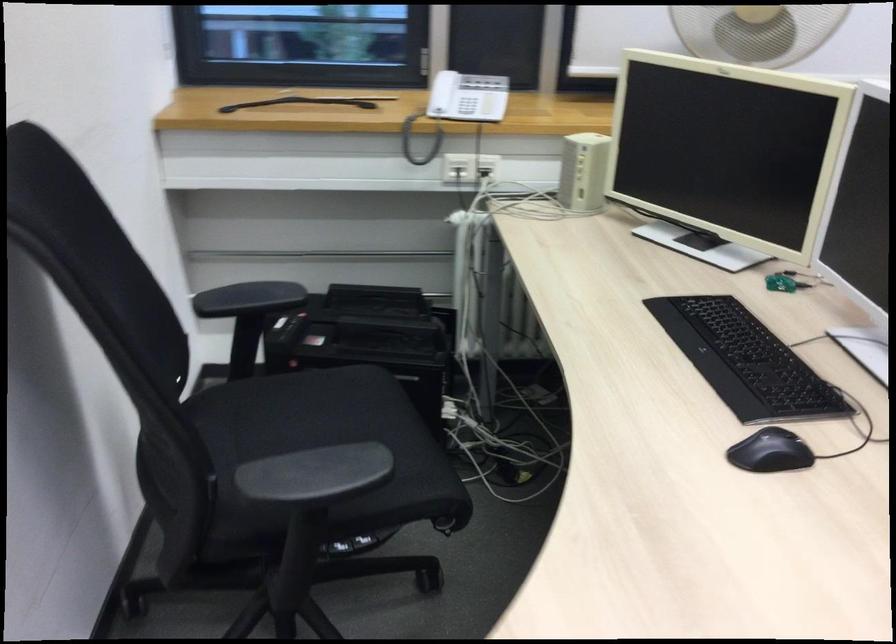
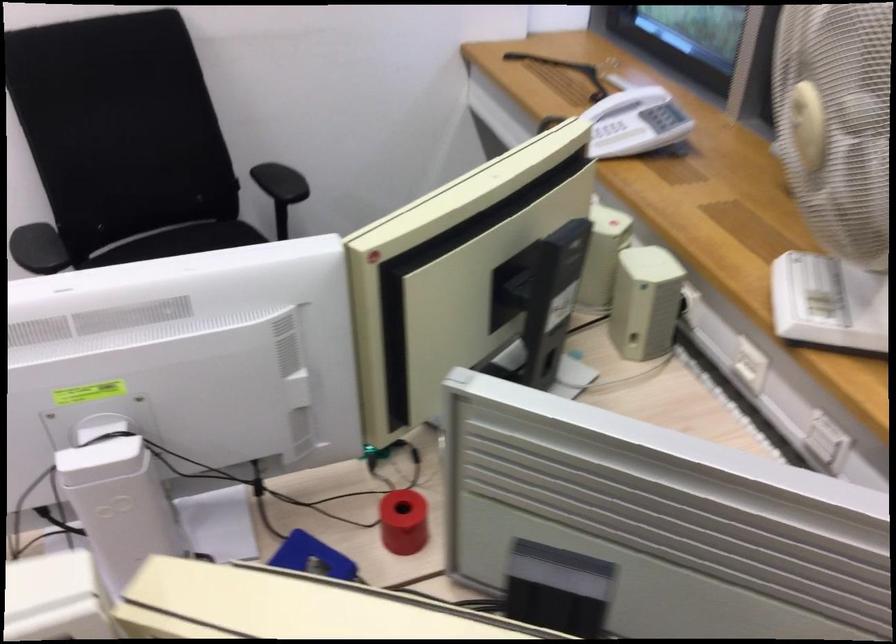
Locate, in the second image, the point that corresponds to point 167,459 in the first image.

(179, 240)